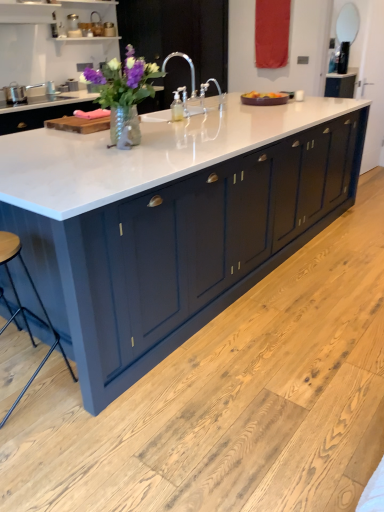
Measure the distance between point [23,317] and camera.

The distance of point [23,317] from camera is 2.33 meters.

Measure the distance between matte silver mirror at upper right and camera.

matte silver mirror at upper right and camera are 3.99 meters apart.

Describe the element at coordinates (195, 89) in the screenshot. I see `white glossy sink at center` at that location.

The image size is (384, 512). What do you see at coordinates (178, 33) in the screenshot? I see `satin nickel faucet at center` at bounding box center [178, 33].

The image size is (384, 512). I want to click on wooden seat at lower left, so click(x=25, y=308).

In the scene shown: From the image's perspective, relative to white marble countertop at center, is matte glass vase at center above or below?

From the image's perspective, matte glass vase at center appears above white marble countertop at center.

Would you consider matte glass vase at center to be distant from white marble countertop at center?

Actually, matte glass vase at center and white marble countertop at center are a little close together.

Is the depth of matte glass vase at center greater than that of white marble countertop at center?

Yes.

Which of these two, matte glass vase at center or white marble countertop at center, is bigger?

white marble countertop at center is bigger.

Is white marble countertop at center at the back of wooden seat at lower left?

wooden seat at lower left is not turned away from white marble countertop at center.

From a real-world perspective, is wooden seat at lower left physically located above or below white marble countertop at center?

→ From a real-world perspective, wooden seat at lower left is physically below white marble countertop at center.

Is wooden seat at lower left far away from white marble countertop at center?

Yes, wooden seat at lower left and white marble countertop at center are located far from each other.

From the image's perspective, between wooden seat at lower left and white marble countertop at center, who is located below?

wooden seat at lower left, from the image's perspective.

Which is correct: matte silver mirror at upper right is inside satin nickel faucet at center, or outside of it?

matte silver mirror at upper right is located beyond the bounds of satin nickel faucet at center.

From a real-world perspective, is matte silver mirror at upper right under satin nickel faucet at center?

Incorrect, from a real-world perspective, matte silver mirror at upper right is higher than satin nickel faucet at center.

From the image's perspective, which is below, matte silver mirror at upper right or satin nickel faucet at center?

satin nickel faucet at center appears lower in the image.

Which object is further away from the camera taking this photo, satin nickel faucet at center or wooden seat at lower left?

satin nickel faucet at center is more distant.

Is point (213, 16) positioned behind point (9, 232)?

Yes, point (213, 16) is behind point (9, 232).

Between satin nickel faucet at center and wooden seat at lower left, which one has less height?

wooden seat at lower left is shorter.

Would you say satin nickel faucet at center is a long distance from wooden seat at lower left?

Indeed, satin nickel faucet at center is not near wooden seat at lower left.

Is matte silver mirror at upper right spatially inside matte glass vase at center, or outside of it?

matte silver mirror at upper right is located beyond the bounds of matte glass vase at center.

Image resolution: width=384 pixels, height=512 pixels. I want to click on mirror located behind the matte glass vase at center, so click(346, 33).

Which of these two, matte silver mirror at upper right or matte glass vase at center, stands shorter?

Standing shorter between the two is matte glass vase at center.

Measure the distance from matte silver mirror at upper right to matte glass vase at center.

They are 9.58 feet apart.

Is point (139, 137) closer or farther from the camera than point (208, 66)?

Clearly, point (139, 137) is closer to the camera than point (208, 66).

Is matte glass vase at center facing towards satin nickel faucet at center?

No, matte glass vase at center is not oriented towards satin nickel faucet at center.

Is the depth of matte glass vase at center greater than that of satin nickel faucet at center?

No, it is not.

Is the position of matte glass vase at center less distant than that of matte silver mirror at upper right?

Yes.

In the image, there is a matte silver mirror at upper right. Where is `flower below it (from a real-world perspective)`? The width and height of the screenshot is (384, 512). flower below it (from a real-world perspective) is located at coordinates (124, 94).

How many degrees apart are the facing directions of matte glass vase at center and matte silver mirror at upper right?

The facing directions of matte glass vase at center and matte silver mirror at upper right are 118 degrees apart.

Would you say matte glass vase at center contains matte silver mirror at upper right?

No, matte silver mirror at upper right is located outside of matte glass vase at center.

Locate an element on the screen. This screenshot has height=512, width=384. countertop lying in front of the matte glass vase at center is located at coordinates (168, 223).

You are a GUI agent. You are given a task and a screenshot of the screen. Output one action in this format:
    pyautogui.click(x=<x>, y=<y>)
    Task: Click on the bar stool behind the white marble countertop at center
    This screenshot has height=512, width=384.
    Given the screenshot: What is the action you would take?
    pyautogui.click(x=25, y=308)

Which object lies further to the anchor point wooden seat at lower left, matte glass vase at center or matte silver mirror at upper right?

Based on the image, matte silver mirror at upper right appears to be further to wooden seat at lower left.

From the image, which object appears to be farther from matte glass vase at center, matte silver mirror at upper right or satin nickel faucet at center?

satin nickel faucet at center.

Based on their spatial positions, is matte glass vase at center or white glossy sink at center closer to matte silver mirror at upper right?

white glossy sink at center.

Based on their spatial positions, is wooden seat at lower left or satin nickel faucet at center further from white marble countertop at center?

satin nickel faucet at center lies further to white marble countertop at center than the other object.

Based on their spatial positions, is white marble countertop at center or matte glass vase at center closer to satin nickel faucet at center?

white marble countertop at center is closer to satin nickel faucet at center.

Based on their spatial positions, is matte silver mirror at upper right or wooden seat at lower left closer to white glossy sink at center?

matte silver mirror at upper right lies closer to white glossy sink at center than the other object.

From the image, which object appears to be farther from wooden seat at lower left, white glossy sink at center or matte glass vase at center?

white glossy sink at center.

Which object lies further to the anchor point matte silver mirror at upper right, wooden seat at lower left or satin nickel faucet at center?

The object further to matte silver mirror at upper right is wooden seat at lower left.

In order to click on countertop between matte glass vase at center and wooden seat at lower left vertically in this screenshot , I will do `click(168, 223)`.

Identify the location of sink between matte glass vase at center and satin nickel faucet at center from front to back. This screenshot has height=512, width=384. (195, 89).

I want to click on flower between white marble countertop at center and white glossy sink at center along the z-axis, so click(x=124, y=94).

At what (x,y) coordinates should I click in order to perform the action: click on bar stool between white marble countertop at center and white glossy sink at center along the z-axis. Please return your answer as a coordinate pair (x, y). The image size is (384, 512). Looking at the image, I should click on (25, 308).